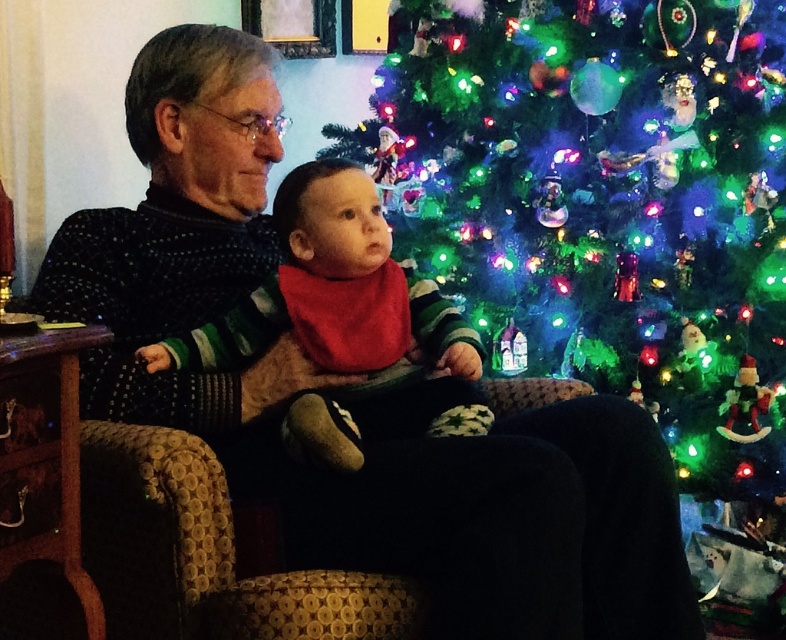
Question: Among these objects, which one is nearest to the camera?

Choices:
 (A) red cotton bib at center
 (B) iridescent plastic ornaments at center

Answer: (A)

Question: Is iridescent plastic ornaments at center bigger than red cotton bib at center?

Choices:
 (A) yes
 (B) no

Answer: (A)

Question: Is iridescent plastic ornaments at center to the left of red cotton bib at center from the viewer's perspective?

Choices:
 (A) no
 (B) yes

Answer: (A)

Question: Which of the following is the closest to the observer?

Choices:
 (A) iridescent plastic ornaments at center
 (B) red cotton bib at center

Answer: (B)

Question: Is iridescent plastic ornaments at center to the left of red cotton bib at center from the viewer's perspective?

Choices:
 (A) no
 (B) yes

Answer: (A)